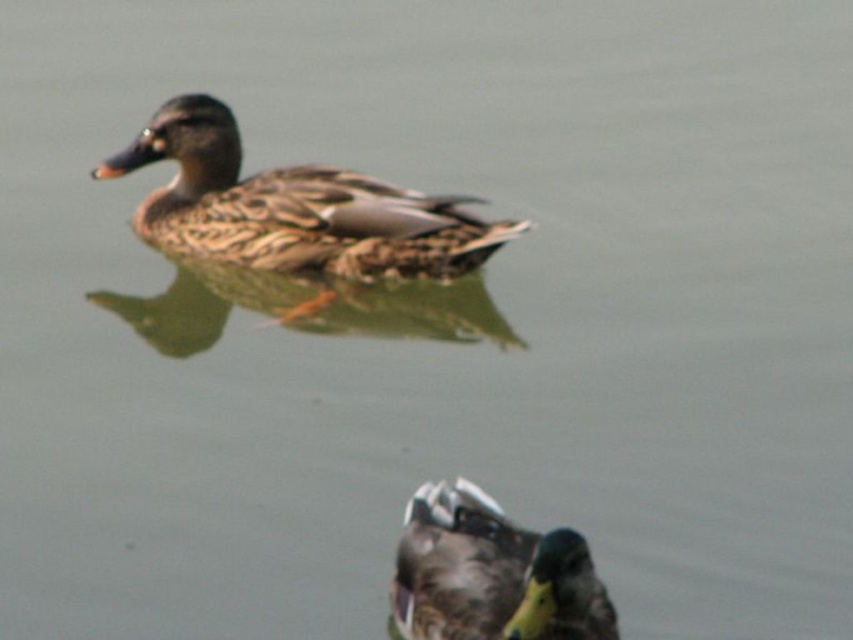
Question: Where is brown speckled feathers at upper center located in relation to brown speckled duck at center in the image?

Choices:
 (A) below
 (B) above

Answer: (B)

Question: Which of the following is the closest to the observer?

Choices:
 (A) (395, 568)
 (B) (349, 195)

Answer: (A)

Question: Is brown speckled feathers at upper center below brown speckled duck at center?

Choices:
 (A) yes
 (B) no

Answer: (B)

Question: Among these points, which one is farthest from the camera?

Choices:
 (A) (204, 145)
 (B) (480, 588)

Answer: (A)

Question: Does brown speckled feathers at upper center appear over brown speckled duck at center?

Choices:
 (A) no
 (B) yes

Answer: (B)